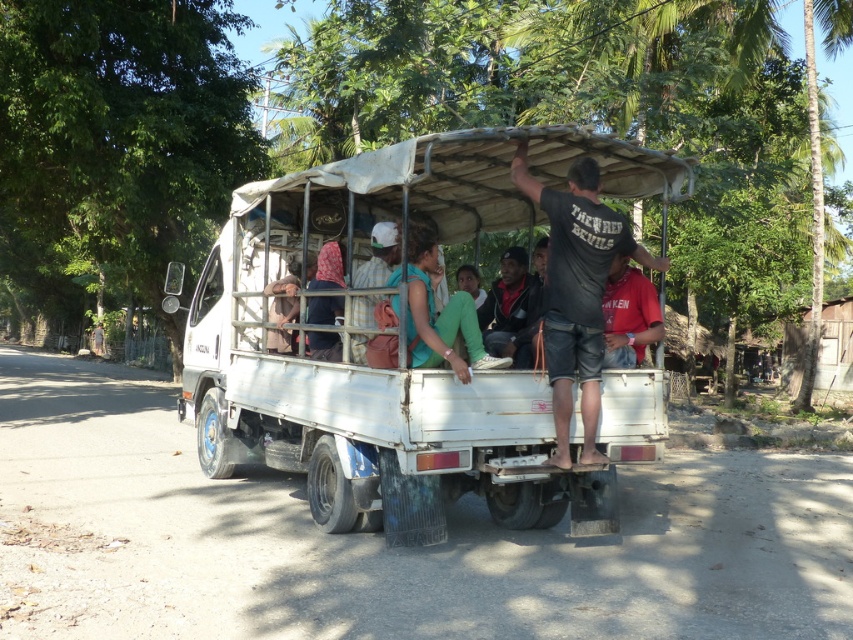
Can you confirm if white matte truck at center is smaller than matte red t-shirt at center?

No, white matte truck at center is not smaller than matte red t-shirt at center.

Find the location of a particular element. Image resolution: width=853 pixels, height=640 pixels. white matte truck at center is located at coordinates (405, 339).

Is white matte truck at center below dark gray fabric jacket at center?

Indeed, white matte truck at center is positioned under dark gray fabric jacket at center.

Does white matte truck at center appear on the left side of dark gray fabric jacket at center?

Yes, white matte truck at center is to the left of dark gray fabric jacket at center.

At what (x,y) coordinates should I click in order to perform the action: click on white matte truck at center. Please return your answer as a coordinate pair (x, y). This screenshot has height=640, width=853. Looking at the image, I should click on (405, 339).

Where is `white matte truck at center`? The height and width of the screenshot is (640, 853). white matte truck at center is located at coordinates (405, 339).

Which is in front, point (576, 179) or point (508, 276)?

Positioned in front is point (576, 179).

From the picture: Is black cotton shirt at center smaller than dark gray fabric jacket at center?

Actually, black cotton shirt at center might be larger than dark gray fabric jacket at center.

Which is behind, point (552, 346) or point (495, 282)?

Positioned behind is point (495, 282).

This screenshot has height=640, width=853. I want to click on black cotton shirt at center, so click(x=576, y=291).